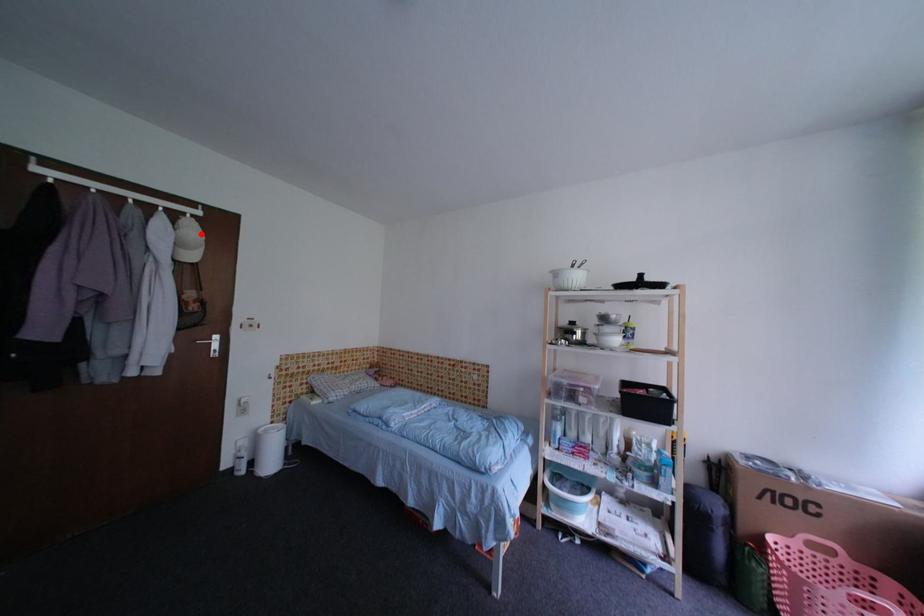
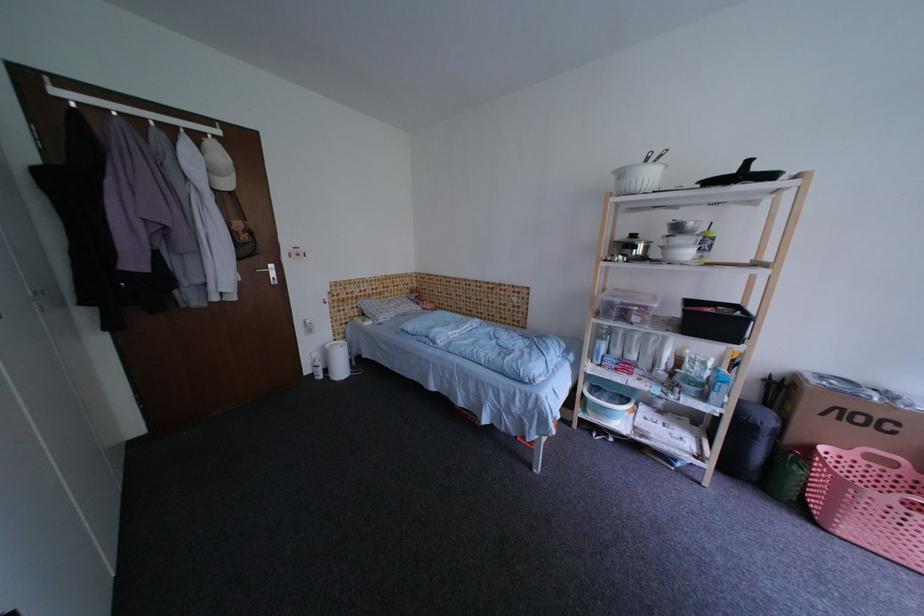
Find the pixel in the second image that matches the highlighted location in the first image.

(227, 158)